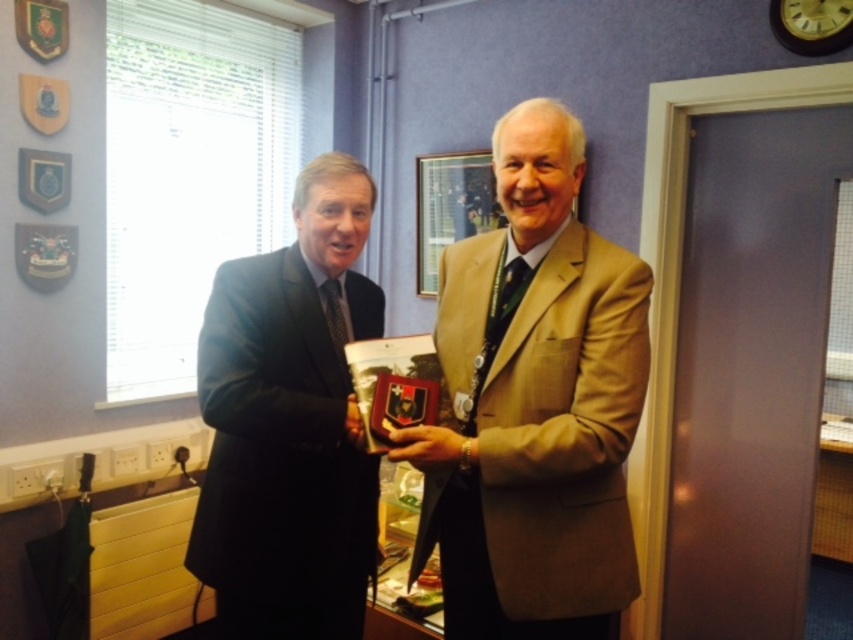
Question: Can you confirm if light brown textured suit at center is positioned to the left of dark blue suit at left?

Choices:
 (A) yes
 (B) no

Answer: (B)

Question: Which object is closer to the camera taking this photo?

Choices:
 (A) light brown textured suit at center
 (B) dark blue suit at left

Answer: (A)

Question: Is light brown textured suit at center bigger than dark blue suit at left?

Choices:
 (A) yes
 (B) no

Answer: (A)

Question: Can you confirm if light brown textured suit at center is positioned below dark blue suit at left?

Choices:
 (A) yes
 (B) no

Answer: (B)